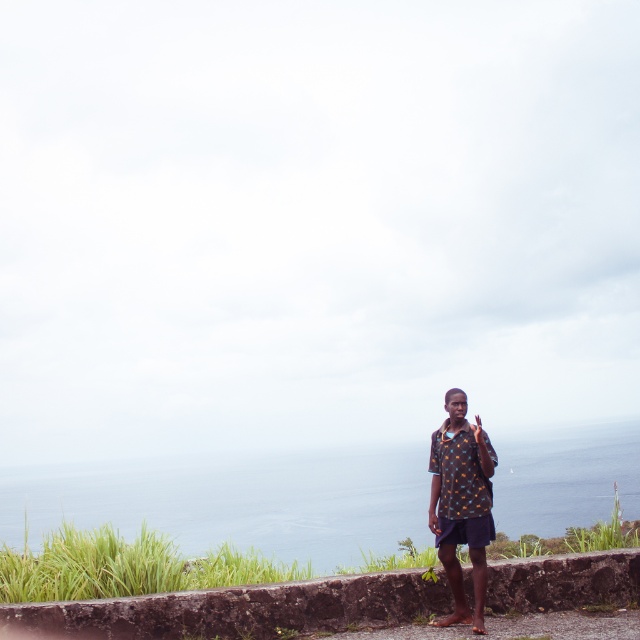
Which of these two, blue water at center or printed fabric shirt at center, stands taller?

Standing taller between the two is blue water at center.

Does blue water at center appear under printed fabric shirt at center?

Yes.

Is point (321, 560) closer to viewer compared to point (490, 472)?

That is False.

This screenshot has height=640, width=640. I want to click on blue water at center, so click(x=236, y=500).

Which is below, rustic stone ledge at lower right or printed fabric shirt at center?

rustic stone ledge at lower right is below.

Is point (332, 621) positioned after point (452, 520)?

Yes, it is behind point (452, 520).

Locate an element on the screen. The image size is (640, 640). rustic stone ledge at lower right is located at coordinates (237, 609).

Is blue water at center to the right of rustic stone ledge at lower right from the viewer's perspective?

Indeed, blue water at center is positioned on the right side of rustic stone ledge at lower right.

Does blue water at center appear on the left side of rustic stone ledge at lower right?

In fact, blue water at center is to the right of rustic stone ledge at lower right.

This screenshot has height=640, width=640. What do you see at coordinates (236, 500) in the screenshot?
I see `blue water at center` at bounding box center [236, 500].

Identify the location of blue water at center. (236, 500).